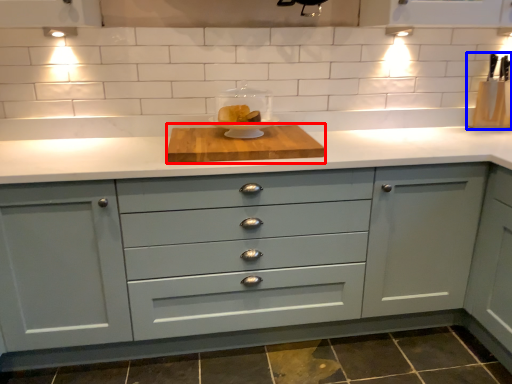
Question: Which of the following is the farthest to the observer, cutting board (highlighted by a red box) or appliance (highlighted by a blue box)?

Choices:
 (A) cutting board
 (B) appliance

Answer: (B)